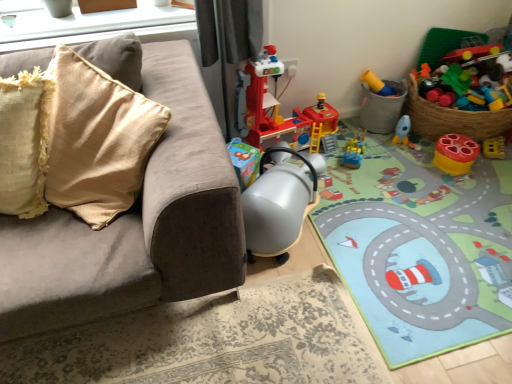
Find the location of a particular element. Image resolution: width=512 pixels, height=384 pixels. free spot in front of matte plastic rocket at lower right, the fourth toy positioned from the left is located at coordinates (411, 164).